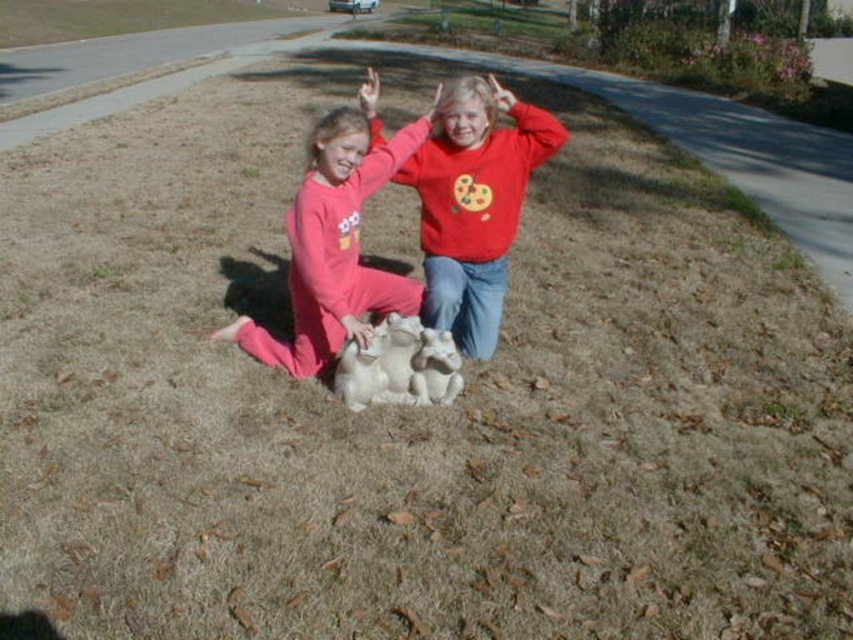
Question: Is pink fleece pants at center closer to the viewer compared to white fur dog at center?

Choices:
 (A) no
 (B) yes

Answer: (B)

Question: Considering the real-world distances, which object is closest to the white fur dog at center?

Choices:
 (A) matte red sweatshirt at center
 (B) pink fleece pants at center

Answer: (B)

Question: Does matte red sweatshirt at center have a greater width compared to pink fleece pants at center?

Choices:
 (A) yes
 (B) no

Answer: (B)

Question: Among these points, which one is nearest to the camera?

Choices:
 (A) (508, 227)
 (B) (363, 294)

Answer: (B)

Question: Is matte red sweatshirt at center to the left of white fur dog at center from the viewer's perspective?

Choices:
 (A) no
 (B) yes

Answer: (A)

Question: Among these points, which one is nearest to the camera?

Choices:
 (A) (477, 310)
 (B) (378, 372)

Answer: (B)